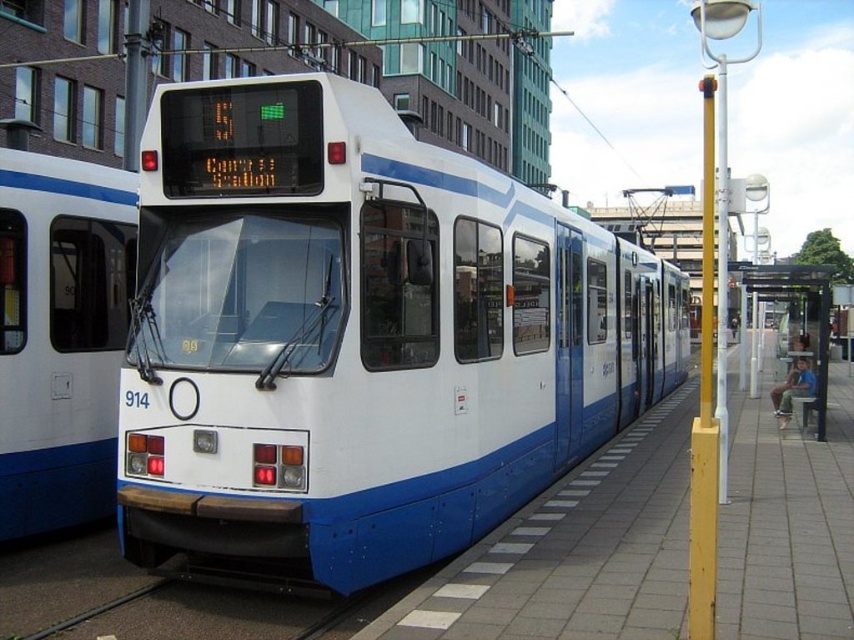
Is white glossy train at center to the left of transparent plastic bus stop at right from the viewer's perspective?

Yes, white glossy train at center is to the left of transparent plastic bus stop at right.

Can you confirm if white glossy train at center is wider than transparent plastic bus stop at right?

In fact, white glossy train at center might be narrower than transparent plastic bus stop at right.

Which is behind, point (285, 506) or point (816, 317)?

Positioned behind is point (816, 317).

What are the coordinates of `white glossy train at center` in the screenshot? It's located at (361, 336).

Can you confirm if white glossy train at left is taller than transparent plastic bus stop at right?

Incorrect, white glossy train at left's height is not larger of transparent plastic bus stop at right's.

Which is behind, point (39, 230) or point (761, 285)?

The point (761, 285) is behind.

This screenshot has width=854, height=640. What do you see at coordinates (60, 337) in the screenshot? I see `white glossy train at left` at bounding box center [60, 337].

At what (x,y) coordinates should I click in order to perform the action: click on white glossy train at left. Please return your answer as a coordinate pair (x, y). Looking at the image, I should click on (60, 337).

Does white glossy train at center lie in front of white glossy train at left?

Yes.

Is point (338, 129) farther from viewer compared to point (120, 227)?

No, it is not.

Locate an element on the screen. white glossy train at center is located at coordinates (361, 336).